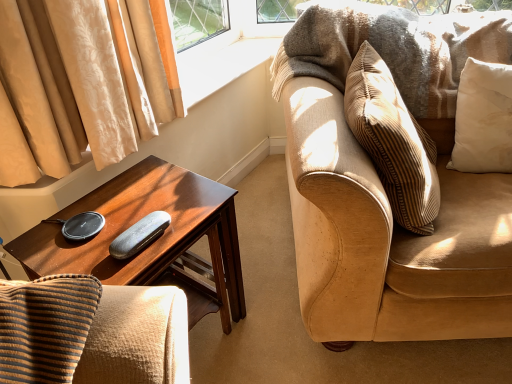
I want to click on empty space that is ontop of shiny brown wood desk at left (from a real-world perspective), so click(130, 206).